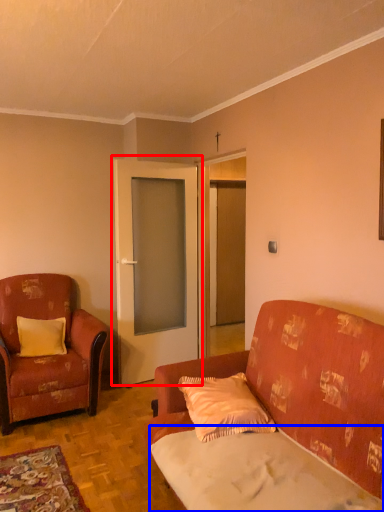
Question: Which point is closer to the camera, door (highlighted by a red box) or sheet (highlighted by a blue box)?

Choices:
 (A) door
 (B) sheet

Answer: (B)